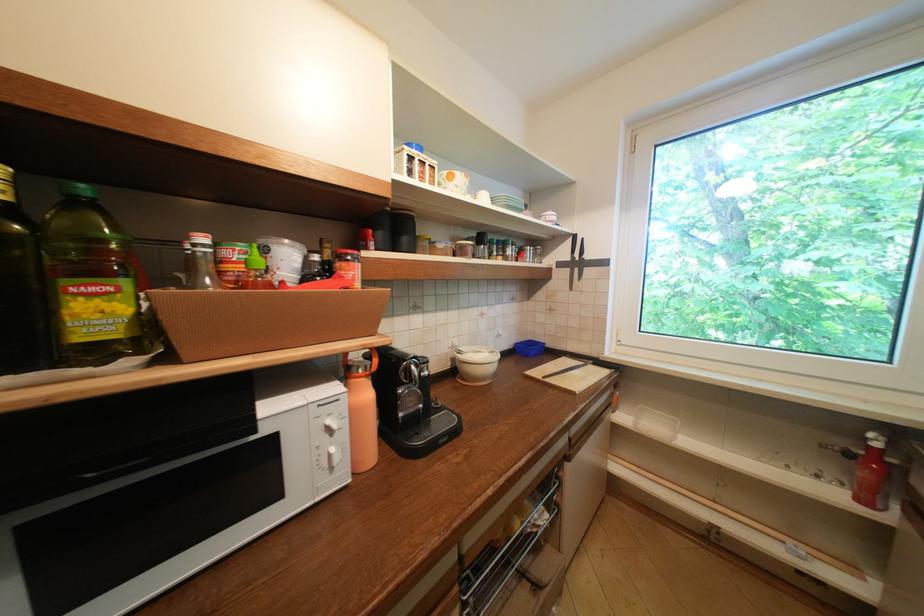
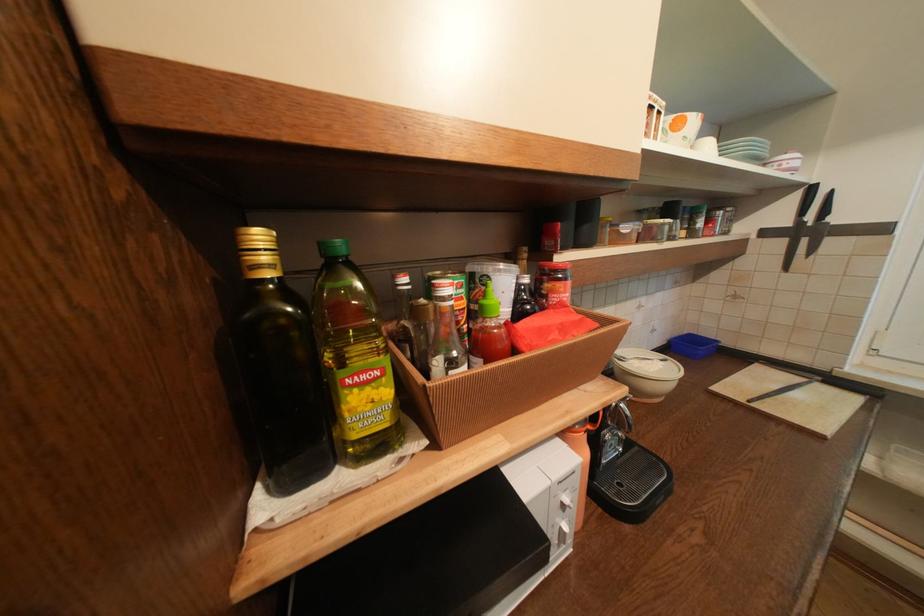
In the second image, find the point that corresponds to point (456, 172) in the first image.

(683, 118)